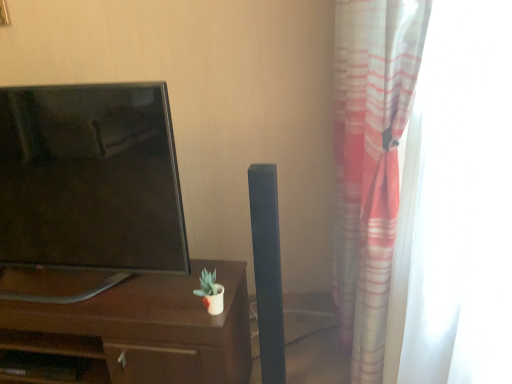
The image size is (512, 384). In order to click on vacant point above brown wood desk at center (from a real-world perspective) in this screenshot , I will do `click(103, 288)`.